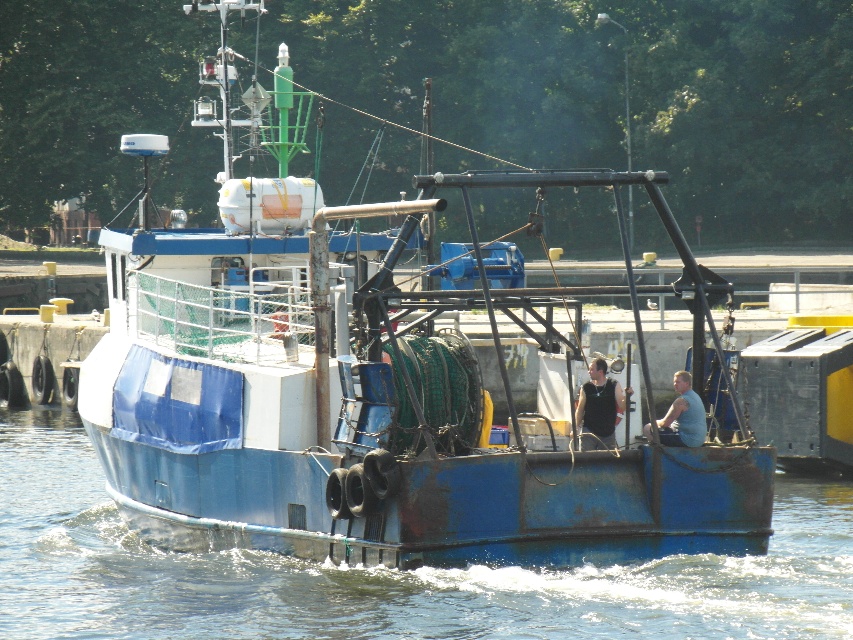
Which is more to the left, blue matte boat at center or black tank top at center?

From the viewer's perspective, blue matte boat at center appears more on the left side.

Is blue matte boat at center to the right of black tank top at center from the viewer's perspective?

Incorrect, blue matte boat at center is not on the right side of black tank top at center.

Is point (263, 301) closer to viewer compared to point (614, 413)?

Yes.

Where is `blue matte boat at center`? This screenshot has height=640, width=853. blue matte boat at center is located at coordinates (372, 401).

Does blue matte boat at center appear over blue metallic water at center?

Yes.

Which is more to the right, blue matte boat at center or blue metallic water at center?

blue matte boat at center is more to the right.

Is point (728, 522) closer to viewer compared to point (4, 568)?

Yes, point (728, 522) is closer to viewer.

At what (x,y) coordinates should I click in order to perform the action: click on blue matte boat at center. Please return your answer as a coordinate pair (x, y). Looking at the image, I should click on (372, 401).

Does black tank top at center appear under blue fabric shirt at center?

Incorrect, black tank top at center is not positioned below blue fabric shirt at center.

Does point (584, 435) lie behind point (648, 440)?

That is True.

Describe the element at coordinates (599, 406) in the screenshot. I see `black tank top at center` at that location.

You are a GUI agent. You are given a task and a screenshot of the screen. Output one action in this format:
    pyautogui.click(x=<x>, y=<y>)
    Task: Click on the black tank top at center
    This screenshot has height=640, width=853.
    Given the screenshot: What is the action you would take?
    (599, 406)